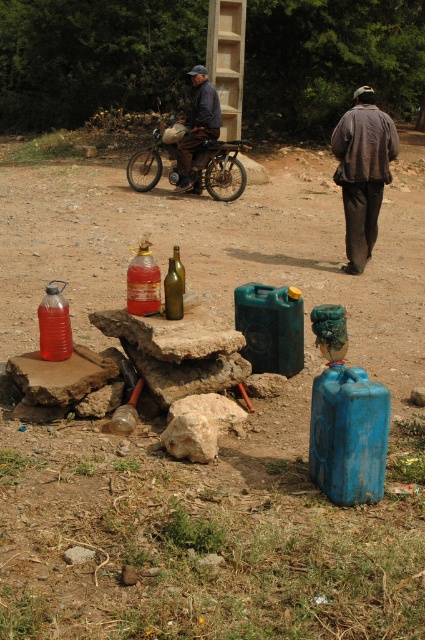
Question: Which point is closer to the camera?

Choices:
 (A) [x=129, y=288]
 (B) [x=206, y=124]
 (C) [x=215, y=192]
 (D) [x=356, y=246]

Answer: (A)

Question: Does metallic silver motorcycle at center appear under dark blue denim jacket at center?

Choices:
 (A) no
 (B) yes

Answer: (B)

Question: Among these points, which one is farthest from the camera?

Choices:
 (A) (56, 312)
 (B) (356, 90)
 (C) (198, 144)
 (D) (158, 282)

Answer: (B)

Question: Can you confirm if brown fabric jacket at upper right is smaller than green glass bottle at center?

Choices:
 (A) yes
 (B) no

Answer: (B)

Question: Which point is closer to the camera?

Choices:
 (A) (223, 157)
 (B) (42, 328)
 (C) (371, 92)
 (D) (164, 305)

Answer: (B)

Question: Can you confirm if metallic silver motorcycle at center is smaller than dark blue denim jacket at center?

Choices:
 (A) no
 (B) yes

Answer: (A)